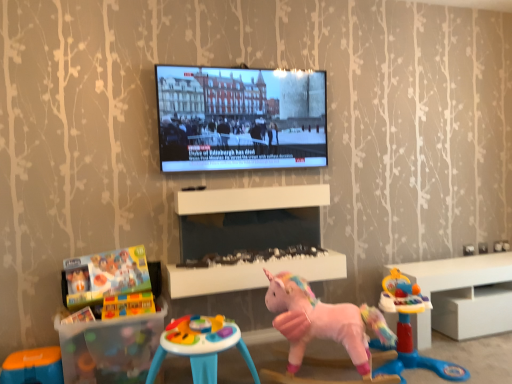
Question: Would you consider pink plush unicorn at center, which is counted as the 5th toy, starting from the left, to be distant from white glossy cabinet at right?

Choices:
 (A) no
 (B) yes

Answer: (A)

Question: From the image's perspective, is pink plush unicorn at center, the 2th toy positioned from the right, located beneath white glossy cabinet at right?

Choices:
 (A) no
 (B) yes

Answer: (B)

Question: Considering the relative sizes of pink plush unicorn at center, which is counted as the 5th toy, starting from the left, and white glossy cabinet at right in the image provided, is pink plush unicorn at center, which is counted as the 5th toy, starting from the left, taller than white glossy cabinet at right?

Choices:
 (A) no
 (B) yes

Answer: (B)

Question: Is pink plush unicorn at center, the 2th toy positioned from the right, beside white glossy cabinet at right?

Choices:
 (A) no
 (B) yes

Answer: (A)

Question: Considering the relative sizes of pink plush unicorn at center, which is counted as the 5th toy, starting from the left, and white glossy cabinet at right in the image provided, is pink plush unicorn at center, which is counted as the 5th toy, starting from the left, shorter than white glossy cabinet at right?

Choices:
 (A) no
 (B) yes

Answer: (A)

Question: Could you tell me if pink plush unicorn at center, the 2th toy positioned from the right, is turned towards white glossy cabinet at right?

Choices:
 (A) no
 (B) yes

Answer: (A)

Question: Is translucent plastic building blocks at lower left, which is counted as the fifth toy, starting from the right, outside white glossy cabinet at right?

Choices:
 (A) yes
 (B) no

Answer: (A)

Question: Does translucent plastic building blocks at lower left, which is counted as the fifth toy, starting from the right, appear on the right side of white glossy cabinet at right?

Choices:
 (A) yes
 (B) no

Answer: (B)

Question: Is translucent plastic building blocks at lower left, which appears as the second toy when viewed from the left, facing away from white glossy cabinet at right?

Choices:
 (A) no
 (B) yes

Answer: (A)

Question: From the image's perspective, is translucent plastic building blocks at lower left, which appears as the second toy when viewed from the left, over white glossy cabinet at right?

Choices:
 (A) yes
 (B) no

Answer: (A)

Question: Considering the relative positions of translucent plastic building blocks at lower left, which appears as the second toy when viewed from the left, and white glossy cabinet at right in the image provided, is translucent plastic building blocks at lower left, which appears as the second toy when viewed from the left, to the left of white glossy cabinet at right from the viewer's perspective?

Choices:
 (A) yes
 (B) no

Answer: (A)

Question: From a real-world perspective, is translucent plastic building blocks at lower left, which is counted as the fifth toy, starting from the right, positioned over white glossy cabinet at right based on gravity?

Choices:
 (A) yes
 (B) no

Answer: (A)

Question: From a real-world perspective, is brick-like plastic blocks at lower left, marked as the 4th toy in a right-to-left arrangement, physically below white glossy cabinet at right?

Choices:
 (A) no
 (B) yes

Answer: (A)